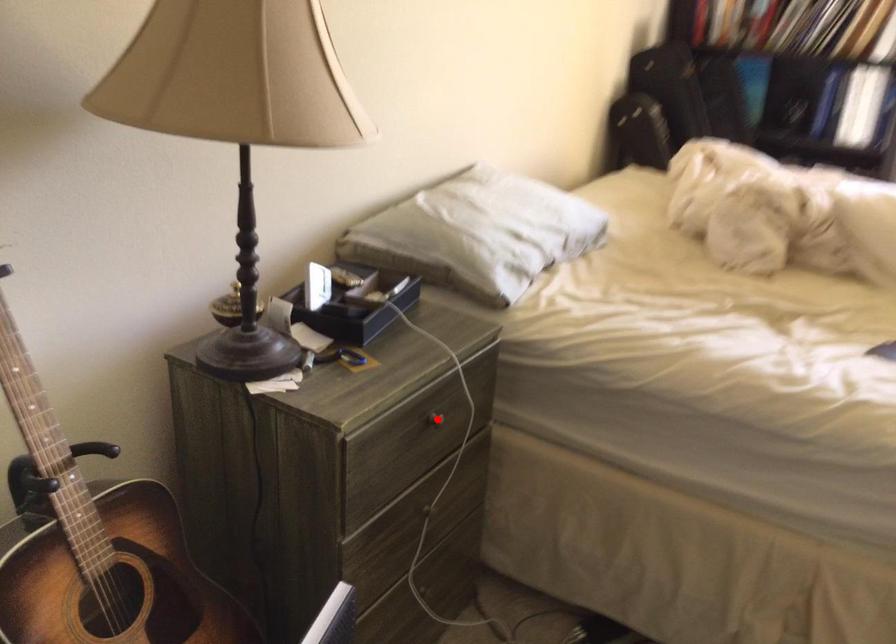
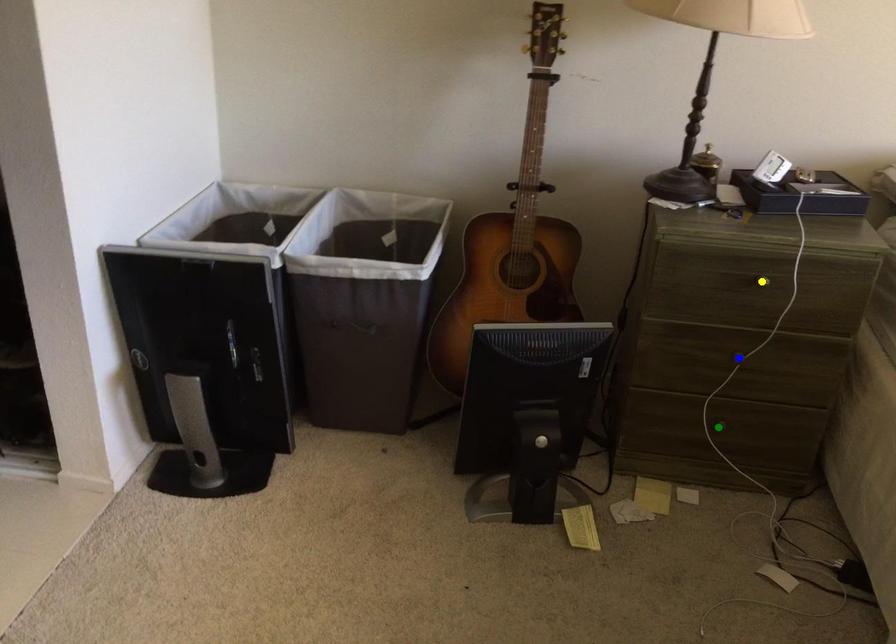
Question: I am providing you with two images of the same scene from different viewpoints. A red point is marked on the first image. You are given multiple points on the second image. Which point in image 2 is actually the same real-world point as the red point in image 1?

Choices:
 (A) green point
 (B) yellow point
 (C) blue point

Answer: (B)